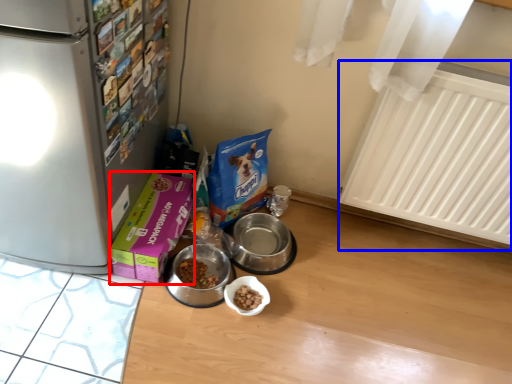
Question: Which object is closer to the camera taking this photo, box (highlighted by a red box) or radiator (highlighted by a blue box)?

Choices:
 (A) box
 (B) radiator

Answer: (B)